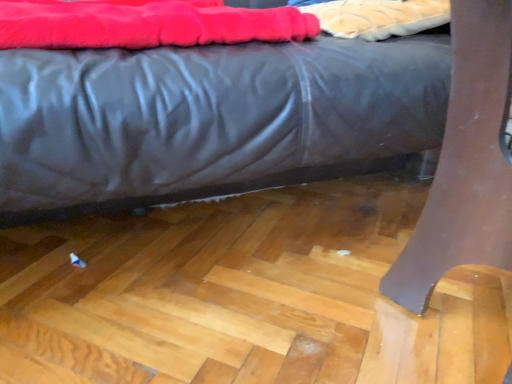
Question: From a real-world perspective, is velvet-like red blanket at upper left on top of velvet-like fabric at upper center?

Choices:
 (A) no
 (B) yes

Answer: (A)

Question: Is velvet-like red blanket at upper left facing away from velvet-like fabric at upper center?

Choices:
 (A) no
 (B) yes

Answer: (A)

Question: Can you confirm if velvet-like red blanket at upper left is shorter than velvet-like fabric at upper center?

Choices:
 (A) no
 (B) yes

Answer: (A)

Question: Can you confirm if velvet-like red blanket at upper left is bigger than velvet-like fabric at upper center?

Choices:
 (A) no
 (B) yes

Answer: (B)

Question: Is velvet-like red blanket at upper left further to camera compared to velvet-like fabric at upper center?

Choices:
 (A) yes
 (B) no

Answer: (B)

Question: Could velvet-like fabric at upper center be considered to be inside velvet-like red blanket at upper left?

Choices:
 (A) no
 (B) yes

Answer: (A)

Question: Considering the relative positions of velvet-like fabric at upper center and matte black bed at center in the image provided, is velvet-like fabric at upper center to the right of matte black bed at center from the viewer's perspective?

Choices:
 (A) no
 (B) yes

Answer: (B)

Question: Are velvet-like fabric at upper center and matte black bed at center located far from each other?

Choices:
 (A) no
 (B) yes

Answer: (A)

Question: Does velvet-like fabric at upper center have a lesser height compared to matte black bed at center?

Choices:
 (A) no
 (B) yes

Answer: (B)

Question: Is velvet-like fabric at upper center facing towards matte black bed at center?

Choices:
 (A) yes
 (B) no

Answer: (A)

Question: Considering the relative sizes of velvet-like fabric at upper center and matte black bed at center in the image provided, is velvet-like fabric at upper center bigger than matte black bed at center?

Choices:
 (A) no
 (B) yes

Answer: (A)

Question: Is matte black bed at center completely or partially inside velvet-like fabric at upper center?

Choices:
 (A) yes
 (B) no

Answer: (B)

Question: Does matte black bed at center have a lesser width compared to velvet-like fabric at upper center?

Choices:
 (A) no
 (B) yes

Answer: (A)